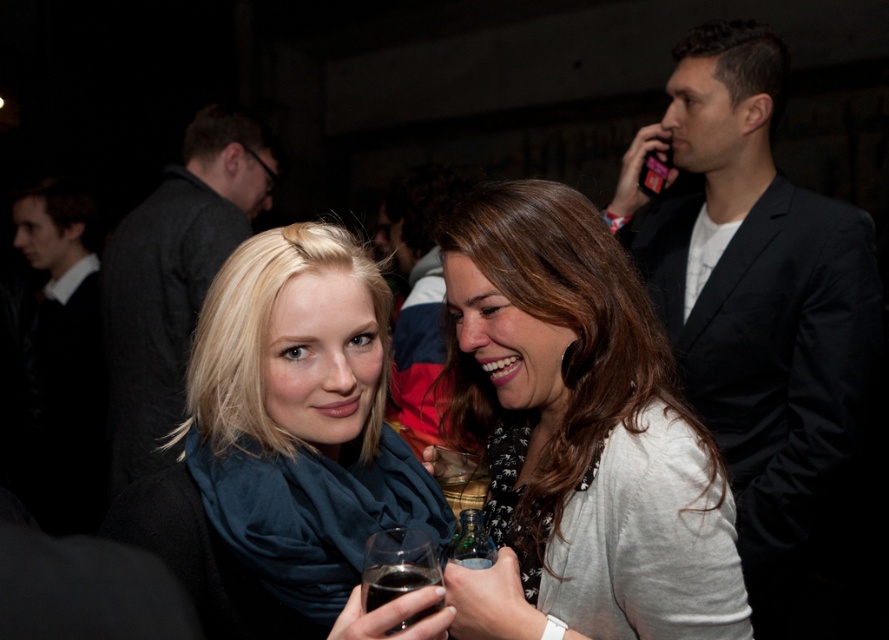
Question: Estimate the real-world distances between objects in this image. Which object is closer to the dark glass at lower center?

Choices:
 (A) matte blue scarf at center
 (B) translucent glass bottle at center

Answer: (B)

Question: Is matte blue scarf at center thinner than dark glass at lower center?

Choices:
 (A) no
 (B) yes

Answer: (A)

Question: Can you confirm if dark gray suit at left is smaller than translucent glass bottle at center?

Choices:
 (A) yes
 (B) no

Answer: (B)

Question: Is black suit jacket at upper right to the right of dark suit jacket at center from the viewer's perspective?

Choices:
 (A) yes
 (B) no

Answer: (A)

Question: Among these objects, which one is farthest from the camera?

Choices:
 (A) dark suit jacket at center
 (B) dark gray sweater at left
 (C) black suit jacket at upper right
 (D) translucent glass bottle at center

Answer: (B)

Question: Which object is closer to the camera taking this photo?

Choices:
 (A) dark glass at lower center
 (B) black suit jacket at upper right
 (C) matte white sweater at center

Answer: (A)